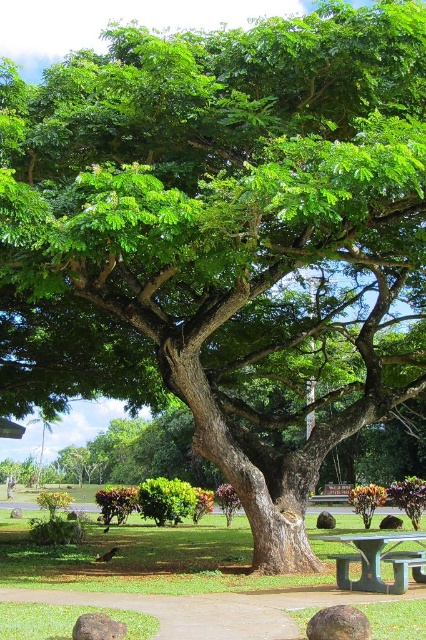
You are standing at the entrance of the park and see the green leafy tree at center. If you walk straight towards it, how far will you have to walk to reach the tree?

The green leafy tree at center is 5.74 meters away from the camera, so you will need to walk approximately 5.74 meters to reach it.

You are standing at the entrance of the park and want to walk directly to the green leafy tree at center. According to the coordinates provided, in which direction should you head from your current position?

The green leafy tree at center is located at coordinates point (167, 577), so you should head towards the right and forward direction from your current position at the entrance.

From the picture: You are standing on the pathway leading to the tree and want to walk to the point marked at coordinates point (241, 554) and point (423, 552). Which point is closer to you?

Point (423, 552) is closer to you because it is in front of point (241, 554), which is behind it.